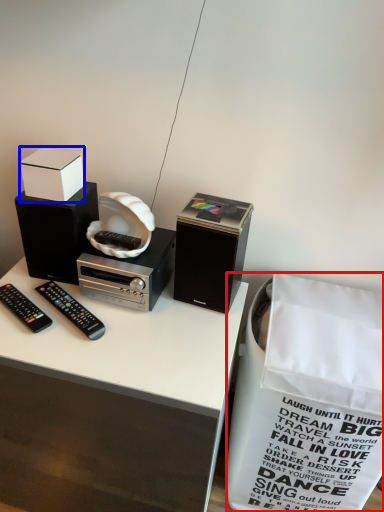
Question: Which object is closer to the camera taking this photo, shopping bag (highlighted by a red box) or box (highlighted by a blue box)?

Choices:
 (A) shopping bag
 (B) box

Answer: (A)